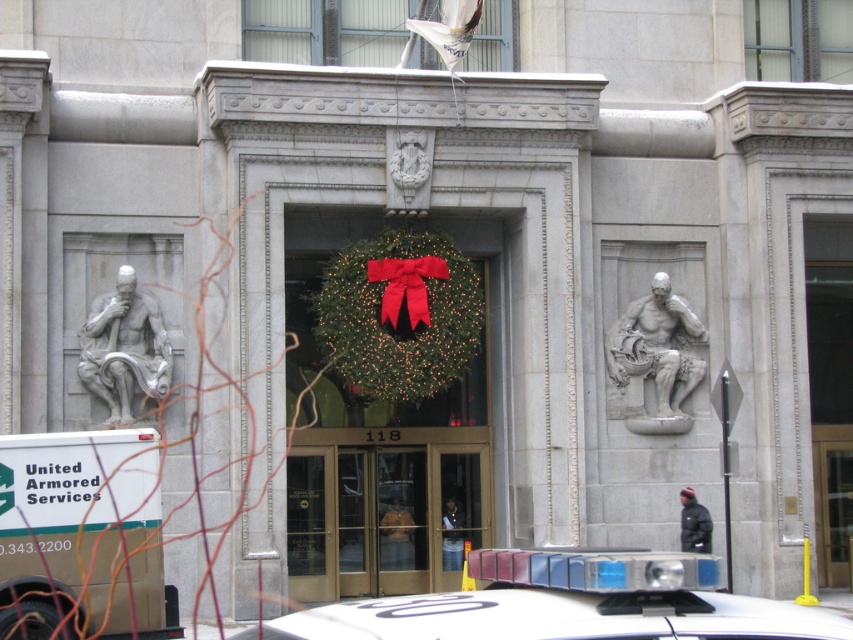
Looking at this image, you are standing at the entrance of the classical building and want to place a small decoration between the two points marked as point (x=88, y=579) and point (x=325, y=452). Since you want the decoration to be closer to the entrance, which point should you choose as the reference point for placement?

Point (x=88, y=579) is in front of point (x=325, y=452), so placing the decoration closer to point (x=88, y=579) would position it nearer to the entrance.

You are standing at the entrance of the building and want to park your car. The parking spot is located at point 0.836, 0.094. Is the white matte van at lower left blocking the parking spot?

The white matte van at lower left is positioned at point (79, 534), which is exactly where the parking spot is located. Therefore, the white matte van at lower left is blocking the parking spot.